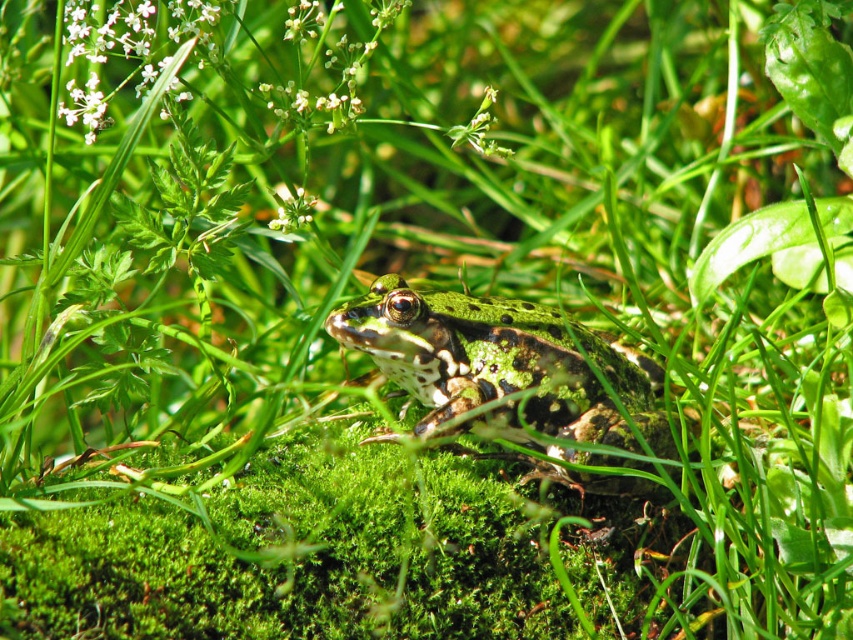
The width and height of the screenshot is (853, 640). What do you see at coordinates (126, 49) in the screenshot? I see `white fluffy flower at upper left` at bounding box center [126, 49].

Is the position of white fluffy flower at upper left more distant than that of green matte flower at upper center?

No.

Is point (78, 17) farther from camera compared to point (283, 211)?

No, (78, 17) is closer to viewer.

Locate an element on the screen. white fluffy flower at upper left is located at coordinates [x=126, y=49].

Is green spotted skin at center positioned in front of white fluffy flower at upper left?

That is True.

Who is higher up, green spotted skin at center or white fluffy flower at upper left?

white fluffy flower at upper left is above.

Between point (347, 323) and point (107, 96), which one is positioned in front?

Positioned in front is point (347, 323).

Locate an element on the screen. Image resolution: width=853 pixels, height=640 pixels. green spotted skin at center is located at coordinates (508, 369).

Can you confirm if green spotted skin at center is bigger than green matte flower at upper center?

Yes.

Between green spotted skin at center and green matte flower at upper center, which one appears on the left side from the viewer's perspective?

From the viewer's perspective, green matte flower at upper center appears more on the left side.

Who is more forward, (512, 336) or (289, 198)?

Positioned in front is point (512, 336).

This screenshot has height=640, width=853. I want to click on green spotted skin at center, so click(508, 369).